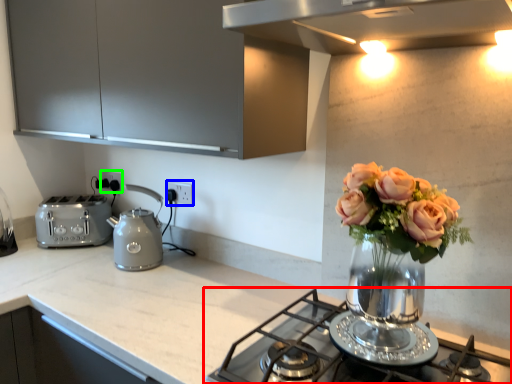
Question: Which is farther away from gas stove (highlighted by a red box)? electric outlet (highlighted by a blue box) or electric outlet (highlighted by a green box)?

Choices:
 (A) electric outlet
 (B) electric outlet

Answer: (B)